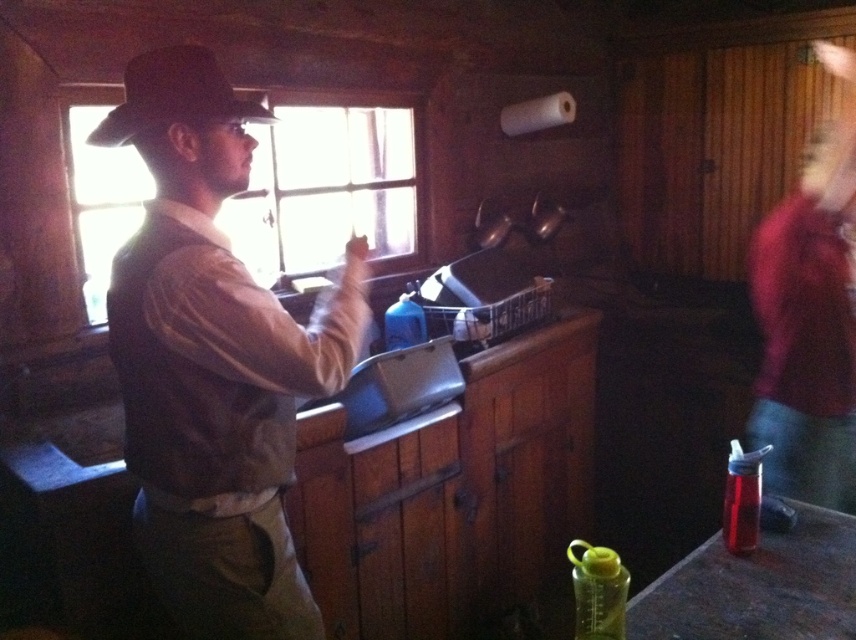
Question: Is brown leather vest at center above wooden frame window at upper center?

Choices:
 (A) no
 (B) yes

Answer: (A)

Question: Estimate the real-world distances between objects in this image. Which object is closer to the wooden frame window at upper center?

Choices:
 (A) brown leather vest at center
 (B) black felt hat at upper left

Answer: (A)

Question: Based on their relative distances, which object is nearer to the brown leather vest at center?

Choices:
 (A) black felt hat at upper left
 (B) wooden frame window at upper center

Answer: (A)

Question: Is brown leather vest at center smaller than wooden frame window at upper center?

Choices:
 (A) no
 (B) yes

Answer: (B)

Question: Can you confirm if brown leather vest at center is thinner than black felt hat at upper left?

Choices:
 (A) no
 (B) yes

Answer: (A)

Question: Which object appears closest to the camera in this image?

Choices:
 (A) black felt hat at upper left
 (B) brown leather vest at center
 (C) wooden frame window at upper center

Answer: (B)